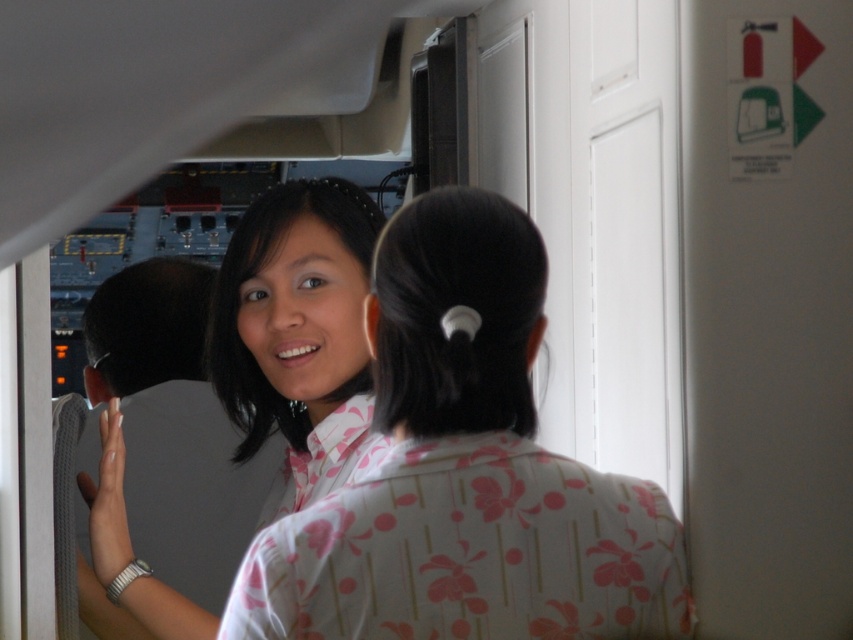
Question: Does pink floral shirt at center have a smaller size compared to matte white shirt at center?

Choices:
 (A) no
 (B) yes

Answer: (B)

Question: Is pink floral shirt at center to the left of matte white shirt at center from the viewer's perspective?

Choices:
 (A) yes
 (B) no

Answer: (B)

Question: Which point appears closest to the camera in this image?

Choices:
 (A) (177, 403)
 (B) (473, 198)

Answer: (B)

Question: Is pink floral shirt at center above matte white shirt at center?

Choices:
 (A) yes
 (B) no

Answer: (A)